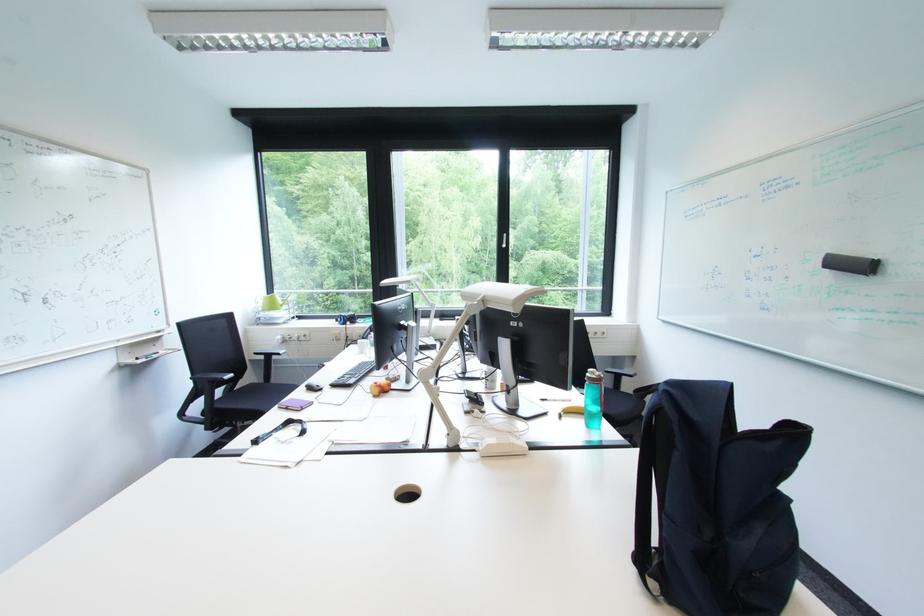
Where is `white lamp arm`? This screenshot has height=616, width=924. white lamp arm is located at coordinates (445, 371).